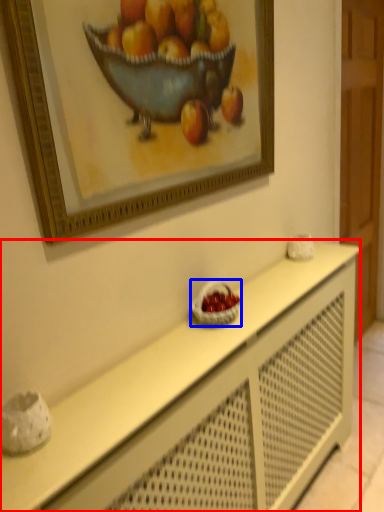
Question: Among these objects, which one is farthest to the camera, table (highlighted by a red box) or basket (highlighted by a blue box)?

Choices:
 (A) table
 (B) basket

Answer: (B)